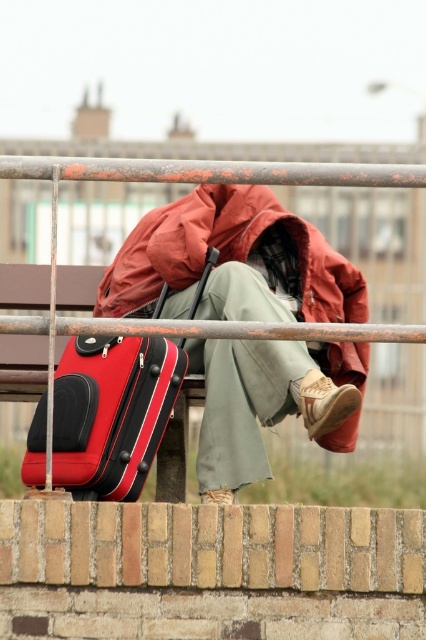
You are a photographer standing in front of the bench. You want to take a photo of the matte red jacket at center and the rubberized red suitcase at left. Which object will appear larger in the photo?

The matte red jacket at center will appear larger in the photo because it is closer to the photographer than the rubberized red suitcase at left.

You are a delivery person who needs to place a package on the bench where the matte red jacket at center and the rubberized red suitcase at left are located. Can you fit the package between them without moving either item?

The matte red jacket at center is much taller than the rubberized red suitcase at left, so there might be enough vertical space between them to place the package. However, since the jacket is taller, it could block access to the space between them. Carefully check the available space before placing the package.

You are a delivery person who needs to place a 6.5 feet long package between the matte red jacket at center and the rubberized red suitcase at left on the bench. Can you fit it there?

The distance between the matte red jacket at center and the rubberized red suitcase at left is 6.67 feet, so the 6.5 feet long package can fit between them since it is slightly shorter than the available space.